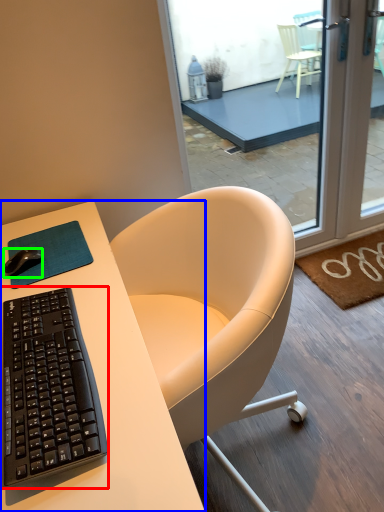
Question: Which object is the farthest from computer keyboard (highlighted by a red box)? Choose among these: desk (highlighted by a blue box) or desk mouse (highlighted by a green box).

Choices:
 (A) desk
 (B) desk mouse

Answer: (B)